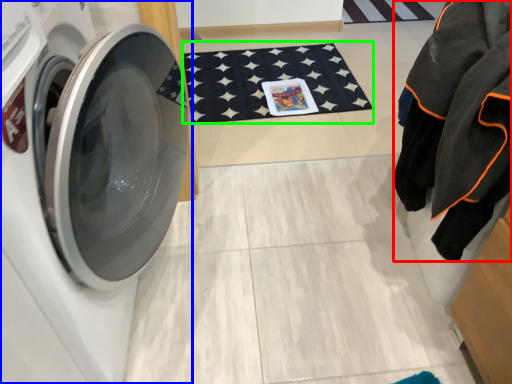
Question: Which object is positioned closest to clothing (highlighted by a red box)? Select from washing machine (highlighted by a blue box) and bath mat (highlighted by a green box).

Choices:
 (A) washing machine
 (B) bath mat

Answer: (A)